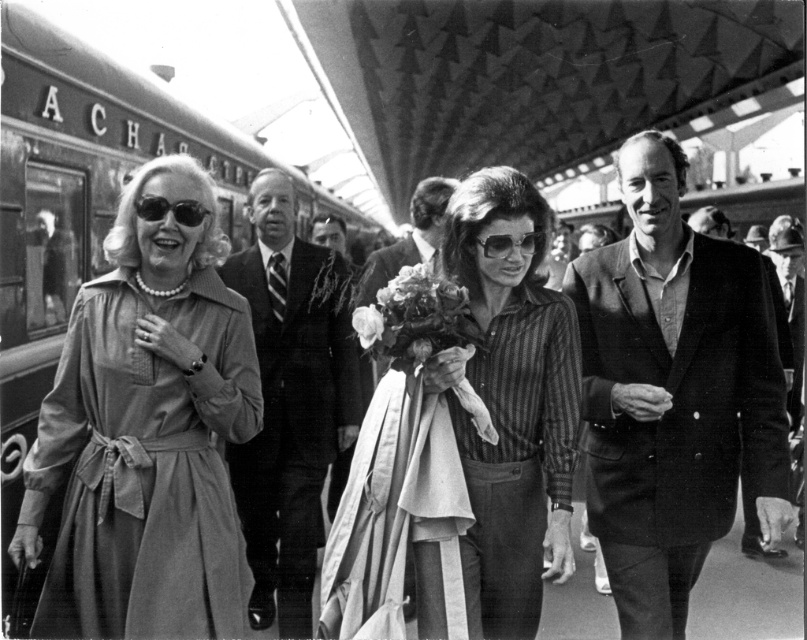
Question: Does striped fabric shirt at center appear under smooth black suit at center?

Choices:
 (A) no
 (B) yes

Answer: (A)

Question: Is smooth black suit at center to the right of matte black sunglasses at left from the viewer's perspective?

Choices:
 (A) yes
 (B) no

Answer: (A)

Question: Which is farther from the smooth black blazer at center?

Choices:
 (A) matte black sunglasses at center
 (B) soft white petals at center
 (C) striped fabric shirt at center
 (D) white silk flower at center

Answer: (D)

Question: Based on their relative distances, which object is farther from the smooth black suit at center?

Choices:
 (A) smooth black blazer at center
 (B) white silk flower at center

Answer: (A)

Question: Which is nearer to the matte black sunglasses at center?

Choices:
 (A) matte beige dress at left
 (B) striped fabric shirt at center
 (C) soft white petals at center

Answer: (C)

Question: Does matte beige dress at left appear over striped fabric shirt at center?

Choices:
 (A) no
 (B) yes

Answer: (B)